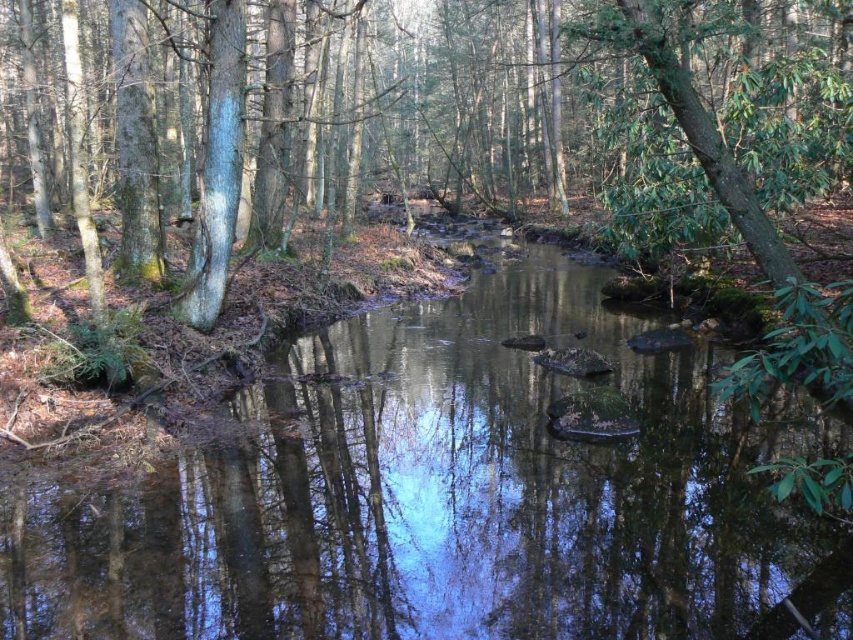
How distant is clear water at center from green leafy tree at center?

The distance of clear water at center from green leafy tree at center is 41.00 feet.

Who is more forward, (520, 566) or (419, 13)?

Positioned in front is point (520, 566).

In order to click on clear water at center in this screenshot , I will do `click(444, 497)`.